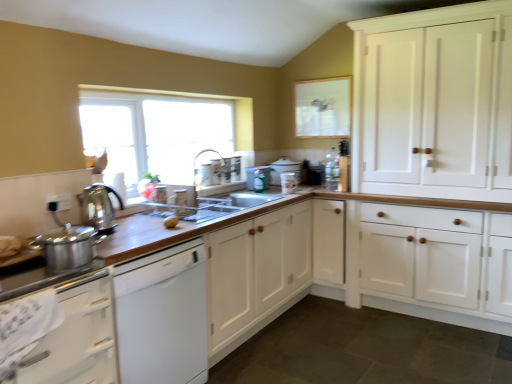
Question: Is clear glass window screen at upper center to the left of satin silver kettle at left, positioned as the 6th appliance in right-to-left order, from the viewer's perspective?

Choices:
 (A) no
 (B) yes

Answer: (A)

Question: Is clear glass window screen at upper center closer to camera compared to satin silver kettle at left, positioned as the 6th appliance in right-to-left order?

Choices:
 (A) yes
 (B) no

Answer: (B)

Question: Is clear glass window screen at upper center bigger than satin silver kettle at left, positioned as the 1th appliance in front-to-back order?

Choices:
 (A) no
 (B) yes

Answer: (A)

Question: Is clear glass window screen at upper center looking in the opposite direction of satin silver kettle at left, positioned as the 6th appliance in right-to-left order?

Choices:
 (A) yes
 (B) no

Answer: (B)

Question: Are clear glass window screen at upper center and satin silver kettle at left, positioned as the 6th appliance in right-to-left order, far apart?

Choices:
 (A) no
 (B) yes

Answer: (B)

Question: Is metallic silver spray bottle at center, which is counted as the 4th appliance, starting from the front, taller or shorter than white wood cabinets at right, the 3th cabinetry viewed from the left?

Choices:
 (A) tall
 (B) short

Answer: (B)

Question: Is metallic silver spray bottle at center, which is counted as the 4th appliance, starting from the front, in front of or behind white wood cabinets at right, the 3th cabinetry viewed from the left, in the image?

Choices:
 (A) front
 (B) behind

Answer: (B)

Question: Considering the positions of point (248, 185) and point (411, 122), is point (248, 185) closer or farther from the camera than point (411, 122)?

Choices:
 (A) farther
 (B) closer

Answer: (A)

Question: From the image's perspective, relative to white wood cabinets at right, the 3th cabinetry viewed from the left, is metallic silver spray bottle at center, the 3th appliance positioned from the left, above or below?

Choices:
 (A) below
 (B) above

Answer: (A)

Question: Is clear glass window screen at upper center taller or shorter than yellow matte potato at center?

Choices:
 (A) short
 (B) tall

Answer: (B)

Question: Is clear glass window screen at upper center in front of or behind yellow matte potato at center in the image?

Choices:
 (A) front
 (B) behind

Answer: (B)

Question: Is clear glass window screen at upper center inside the boundaries of yellow matte potato at center, or outside?

Choices:
 (A) outside
 (B) inside

Answer: (A)

Question: Is clear glass window screen at upper center to the left or to the right of yellow matte potato at center in the image?

Choices:
 (A) right
 (B) left

Answer: (A)

Question: Choose the correct answer: Is satin silver kettle at left, positioned as the 1th appliance in front-to-back order, inside matte white mug at upper center, marked as the 2th appliance in a right-to-left arrangement, or outside it?

Choices:
 (A) inside
 (B) outside

Answer: (B)

Question: In terms of size, does satin silver kettle at left, positioned as the 1th appliance in front-to-back order, appear bigger or smaller than matte white mug at upper center, acting as the third appliance starting from the front?

Choices:
 (A) big
 (B) small

Answer: (A)